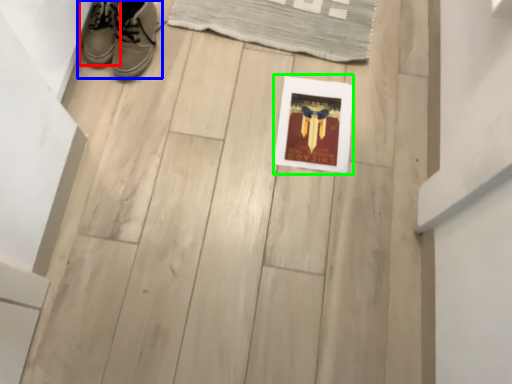
Question: Based on their relative distances, which object is farther from footwear (highlighted by a red box)? Choose from footwear (highlighted by a blue box) and picture frame (highlighted by a green box).

Choices:
 (A) footwear
 (B) picture frame

Answer: (B)